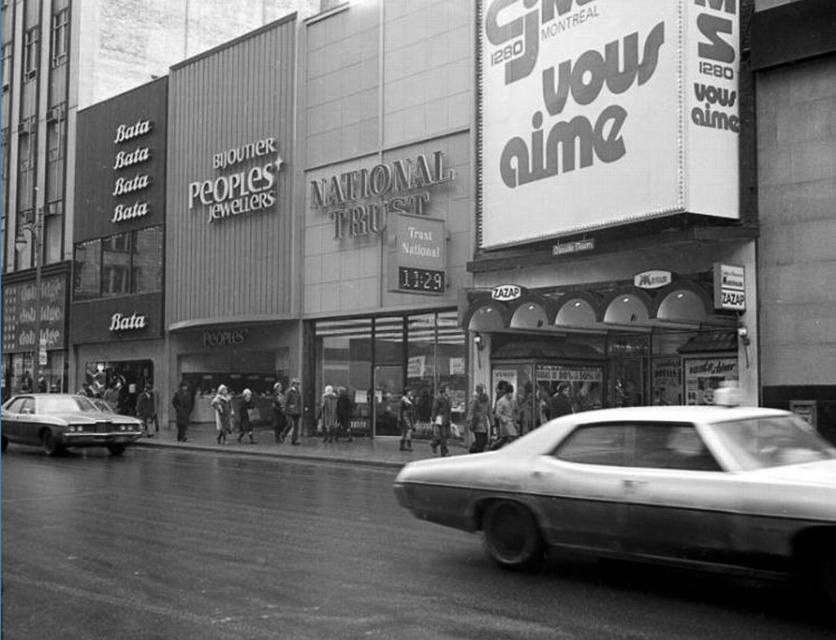
You are a delivery person needing to park your vehicle in a tight space between two buildings. You have a shiny white car at center and a shiny chrome sedan at left. Which vehicle would you choose to park in the space, and why?

You should choose the shiny white car at center because it has a smaller size compared to the shiny chrome sedan at left, making it easier to maneuver into tight spaces.

You are a pedestrian standing at the intersection observing the scene. There is a shiny white car at center. Which direction should you look to see the Bata store and the Peoples Jewellers store?

The Bata store and the Peoples Jewellers store are located to the left of the shiny white car at center, so you should look to the left to see them.

You are a pedestrian standing on the sidewalk looking at the street. You see a shiny white car at center and a shiny chrome sedan at left. Which car is closer to you?

The shiny white car at center is closer to you because it is positioned over the shiny chrome sedan at left, indicating it is in front.